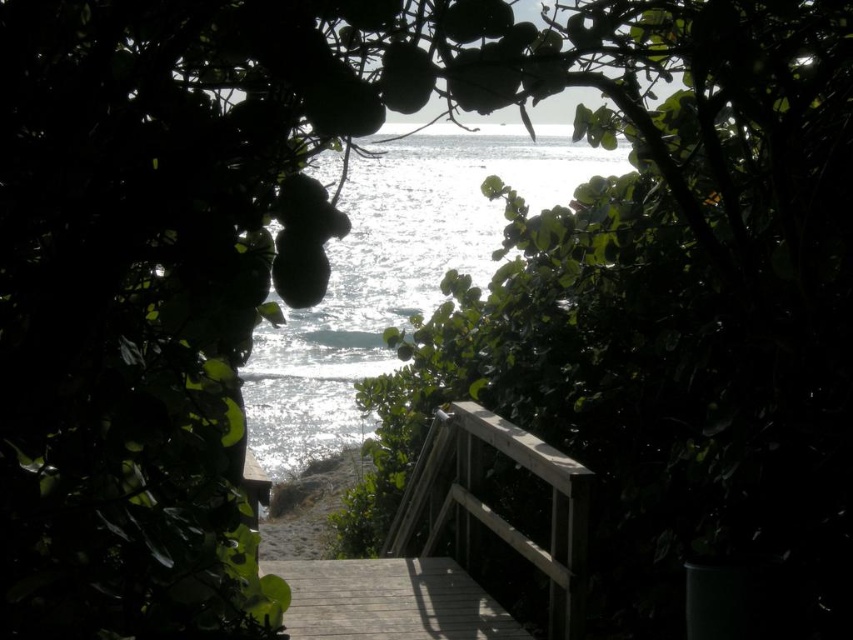
From the picture: You are standing at the bottom of the wooden staircase in the coastal scene. To ensure safety while climbing, you need to know the exact location of the wooden balustrade at center. What are its coordinates?

The wooden balustrade at center is located at coordinates point (492, 509).